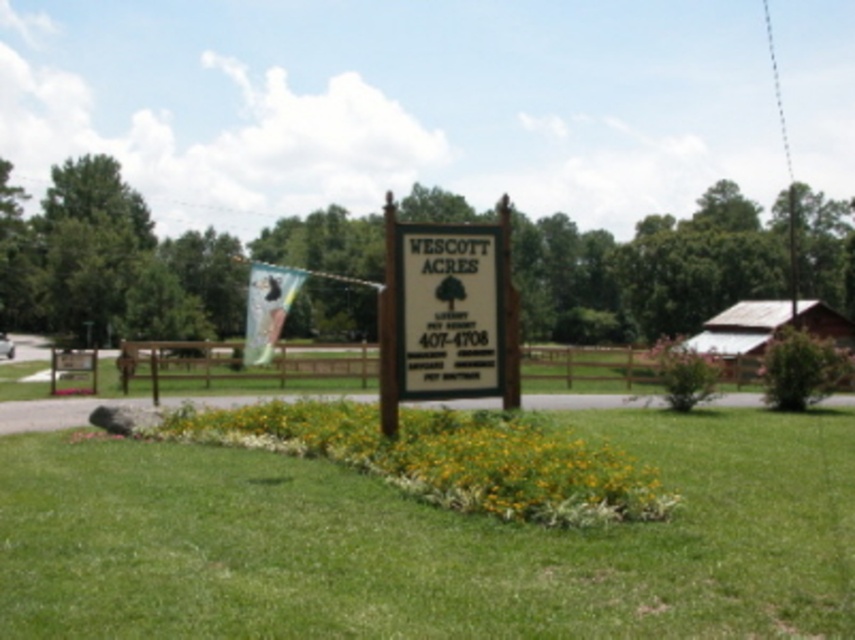
Which of these two, green grass at center or white matte sign at center, stands taller?

white matte sign at center

Is green grass at center below white matte sign at center?

Yes, green grass at center is below white matte sign at center.

Is point (693, 484) closer to camera compared to point (460, 244)?

That is True.

Identify the location of green grass at center. Image resolution: width=855 pixels, height=640 pixels. (428, 541).

Between point (46, 620) and point (531, 444), which one is positioned behind?

Point (531, 444)

Based on the photo, does green grass at center appear under yellow-green foliage at center?

Yes, green grass at center is below yellow-green foliage at center.

Which is in front, point (243, 465) or point (634, 516)?

Point (634, 516) is in front.

This screenshot has width=855, height=640. I want to click on green grass at center, so click(x=428, y=541).

Can you confirm if yellow-green foliage at center is bigger than white matte sign at center?

Incorrect, yellow-green foliage at center is not larger than white matte sign at center.

Locate an element on the screen. The height and width of the screenshot is (640, 855). yellow-green foliage at center is located at coordinates (445, 458).

Locate an element on the screen. yellow-green foliage at center is located at coordinates (445, 458).

Image resolution: width=855 pixels, height=640 pixels. I want to click on yellow-green foliage at center, so click(x=445, y=458).